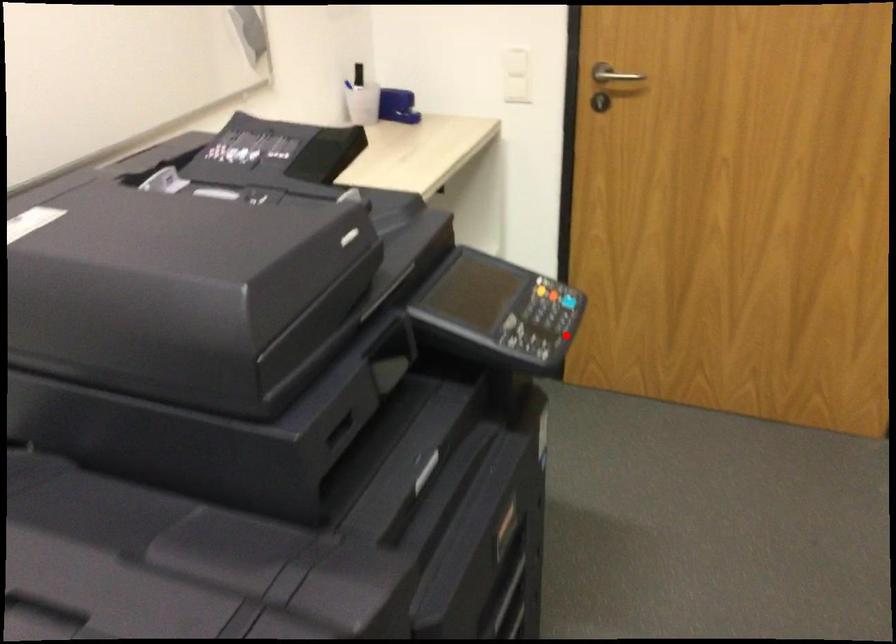
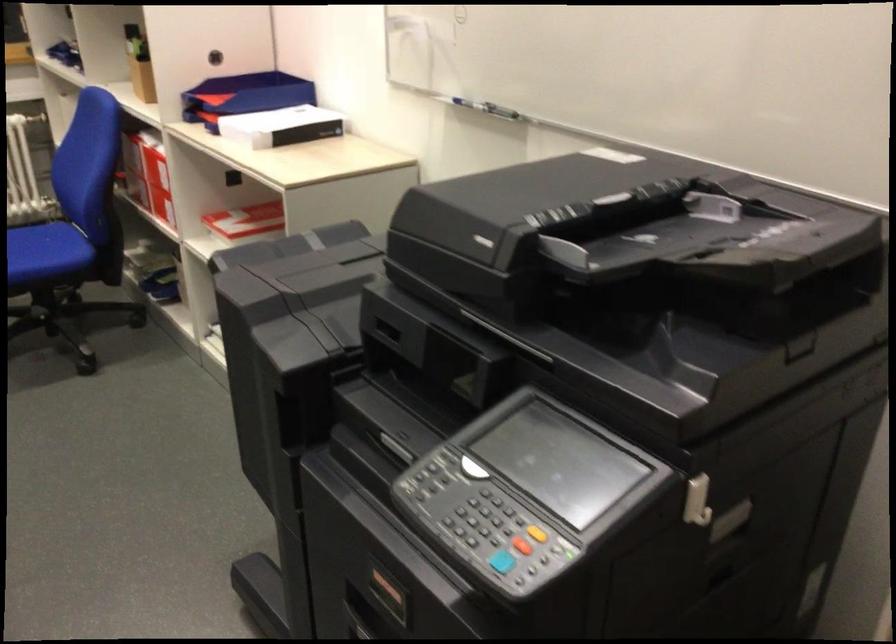
Question: I am providing you with two images of the same scene from different viewpoints. Given a red point in image1, look at the same physical point in image2. Is it:

Choices:
 (A) Closer to the viewpoint
 (B) Farther from the viewpoint

Answer: (A)